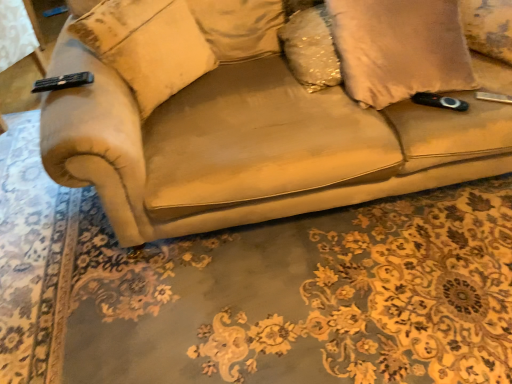
Question: From the image's perspective, is beige fabric pillow at left, which is the first pillow in left-to-right order, on suede-like beige pillow at upper right, which is the 4th pillow from left to right?

Choices:
 (A) yes
 (B) no

Answer: (B)

Question: Is beige fabric pillow at left, positioned as the fourth pillow in right-to-left order, to the left of suede-like beige pillow at upper right, which is the 4th pillow from left to right, from the viewer's perspective?

Choices:
 (A) yes
 (B) no

Answer: (A)

Question: Is beige fabric pillow at left, positioned as the fourth pillow in right-to-left order, facing away from suede-like beige pillow at upper right, which is the 4th pillow from left to right?

Choices:
 (A) no
 (B) yes

Answer: (A)

Question: Does beige fabric pillow at left, which is the first pillow in left-to-right order, have a larger size compared to suede-like beige pillow at upper right, which ranks as the 1th pillow in right-to-left order?

Choices:
 (A) yes
 (B) no

Answer: (A)

Question: From a real-world perspective, is beige fabric pillow at left, positioned as the fourth pillow in right-to-left order, located beneath suede-like beige pillow at upper right, which ranks as the 1th pillow in right-to-left order?

Choices:
 (A) yes
 (B) no

Answer: (B)

Question: From a real-world perspective, is beige fabric pillow at left, which is the first pillow in left-to-right order, positioned above or below sparkly gold pillow at upper center, the second pillow positioned from the left?

Choices:
 (A) above
 (B) below

Answer: (A)

Question: Is beige fabric pillow at left, positioned as the fourth pillow in right-to-left order, spatially inside sparkly gold pillow at upper center, the second pillow positioned from the left, or outside of it?

Choices:
 (A) inside
 (B) outside

Answer: (B)

Question: Is point (183, 72) closer or farther from the camera than point (281, 29)?

Choices:
 (A) closer
 (B) farther

Answer: (A)

Question: From the image's perspective, relative to sparkly gold pillow at upper center, the second pillow positioned from the left, is beige fabric pillow at left, which is the first pillow in left-to-right order, above or below?

Choices:
 (A) below
 (B) above

Answer: (A)

Question: Considering the positions of sparkly gold pillow at upper center, the second pillow positioned from the left, and suede-like beige pillow at upper right, which is the 4th pillow from left to right, in the image, is sparkly gold pillow at upper center, the second pillow positioned from the left, bigger or smaller than suede-like beige pillow at upper right, which is the 4th pillow from left to right,?

Choices:
 (A) small
 (B) big

Answer: (B)

Question: Is sparkly gold pillow at upper center, the second pillow positioned from the left, in front of or behind suede-like beige pillow at upper right, which ranks as the 1th pillow in right-to-left order, in the image?

Choices:
 (A) behind
 (B) front

Answer: (B)

Question: In terms of width, does sparkly gold pillow at upper center, the second pillow positioned from the left, look wider or thinner when compared to suede-like beige pillow at upper right, which is the 4th pillow from left to right?

Choices:
 (A) wide
 (B) thin

Answer: (A)

Question: Does point tap(303, 9) appear closer or farther from the camera than point tap(496, 36)?

Choices:
 (A) farther
 (B) closer

Answer: (A)

Question: Based on their positions, is suede-like beige pillow at right, which is counted as the second pillow, starting from the right, located to the left or right of suede-like beige pillow at upper right, which is the 4th pillow from left to right?

Choices:
 (A) left
 (B) right

Answer: (A)

Question: Is point (371, 49) positioned closer to the camera than point (504, 33)?

Choices:
 (A) farther
 (B) closer

Answer: (B)